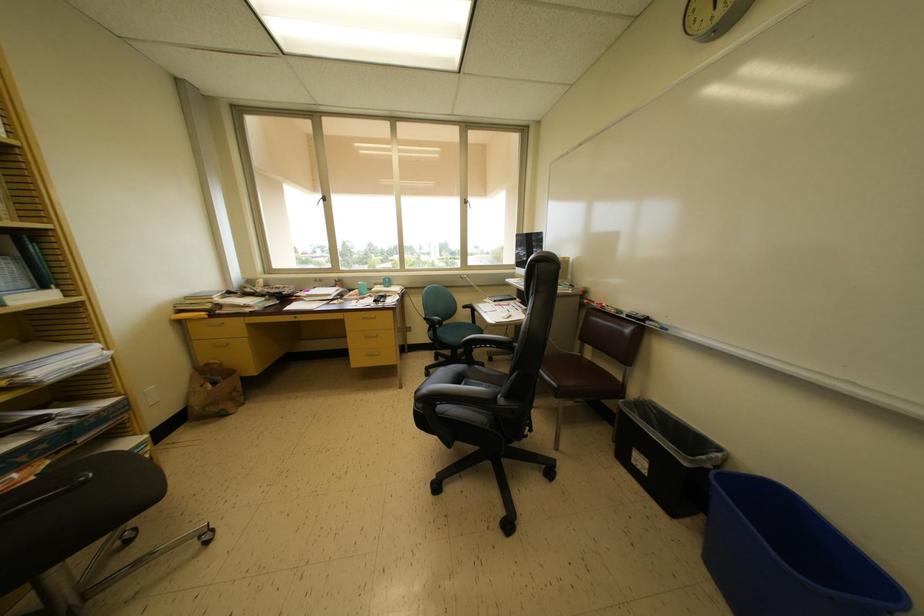
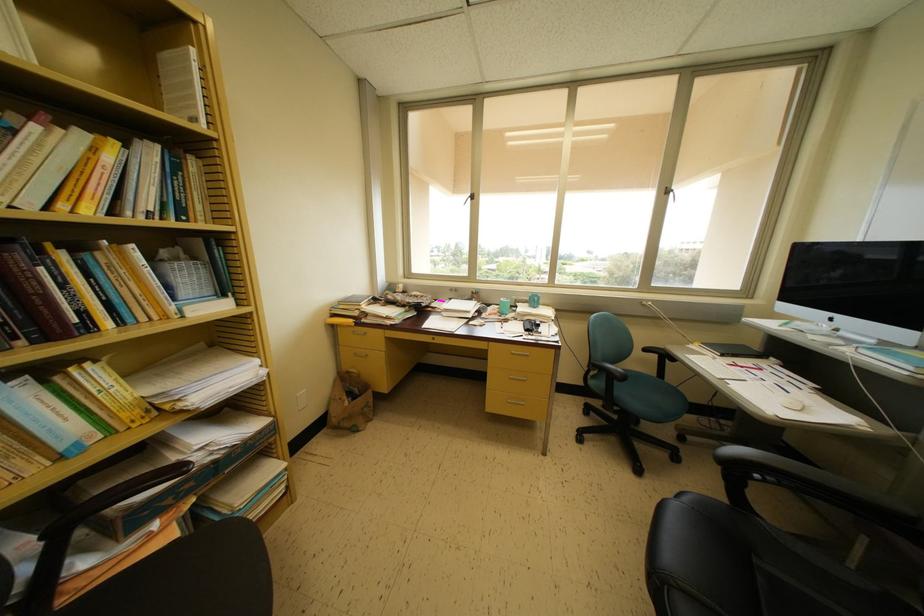
The point at (319, 293) is marked in the first image. Where is the corresponding point in the second image?

(455, 304)